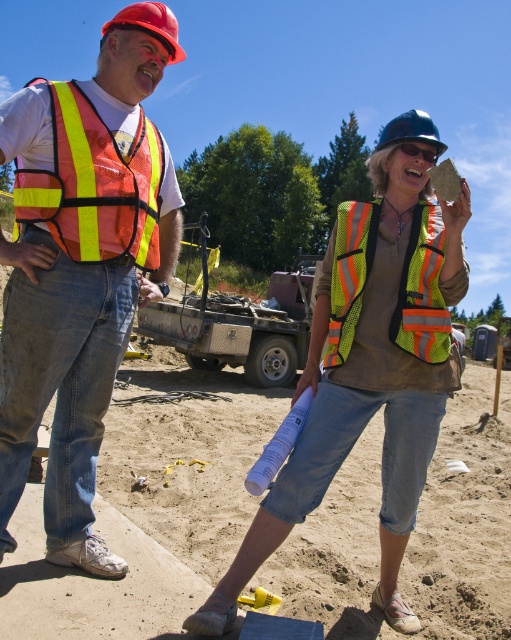
From the picture: You are a construction worker standing at the point with coordinates point [426,129] and need to move to the point with coordinates point [412,150]. Given that both points are on the same horizontal plane, will you be moving towards the camera or away from it?

Since point [426,129] is further to the camera than point [412,150], moving from point [426,129] to point [412,150] means you are moving away from the camera.

You are a safety inspector observing the two safety vests in the image. Which safety vest, the reflective orange safety vest at left or the neon reflective safety vest at center, is closer to you?

The reflective orange safety vest at left is closer to you because it is in front of the neon reflective safety vest at center.